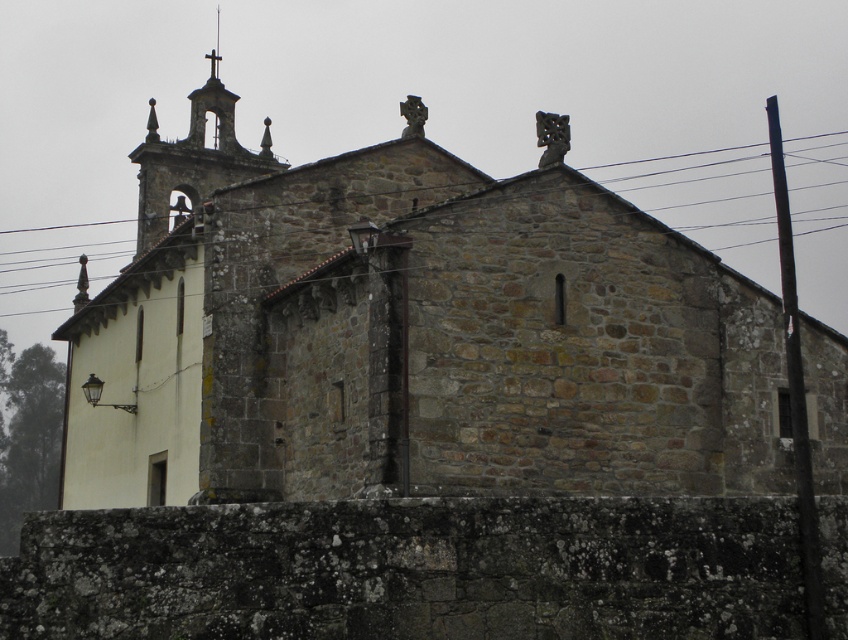
You are standing in front of the stone church at center and notice a black wire at upper center. Which object is positioned higher in the image?

The black wire at upper center is positioned higher than the stone church at center in the image.

You are a drone operator tasked with capturing aerial footage of the stone church at center. Your drone has a maximum flight range of 100 meters. You notice a black wire at upper center in the image. Can your drone safely fly from the church to the black wire without exceeding its range?

The stone church at center is 102.92 meters away from the black wire at upper center. Since the drone has a maximum range of 100 meters, it cannot safely reach the black wire without exceeding its operational limit.